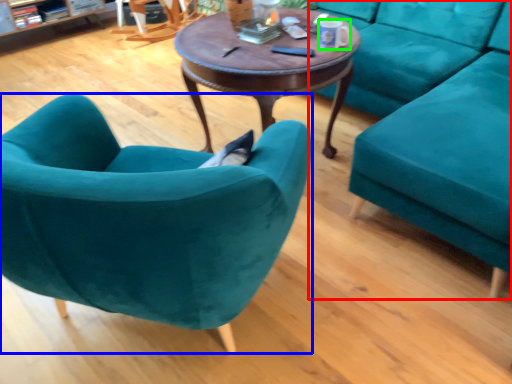
Question: Which object is the farthest from studio couch (highlighted by a red box)? Choose among these: chair (highlighted by a blue box) or coffee cup (highlighted by a green box).

Choices:
 (A) chair
 (B) coffee cup

Answer: (A)